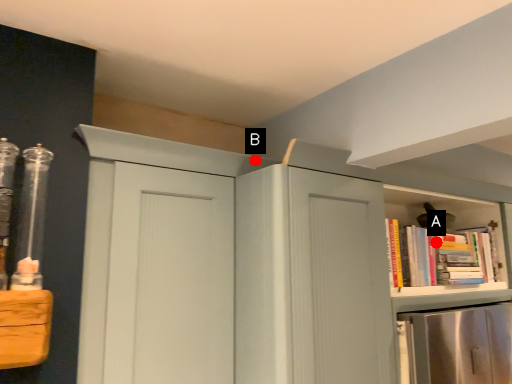
Question: Two points are circled on the image, labeled by A and B beside each circle. Among these points, which one is farthest from the camera?

Choices:
 (A) A is further
 (B) B is further

Answer: (A)